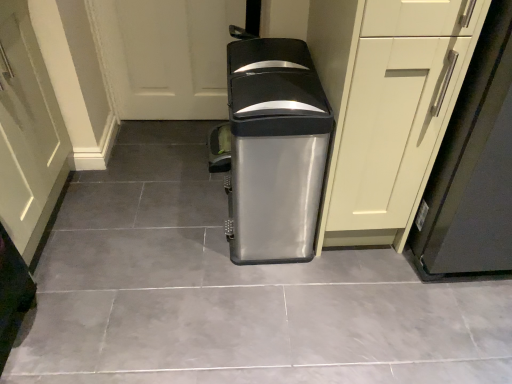
Question: From the image's perspective, is matte white cabinet at center located above matte green door at lower left?

Choices:
 (A) no
 (B) yes

Answer: (B)

Question: Can you confirm if matte white cabinet at center is positioned to the left of matte green door at lower left?

Choices:
 (A) yes
 (B) no

Answer: (B)

Question: Could you tell me if matte white cabinet at center is turned towards matte green door at lower left?

Choices:
 (A) no
 (B) yes

Answer: (A)

Question: Does matte white cabinet at center have a lesser height compared to matte green door at lower left?

Choices:
 (A) yes
 (B) no

Answer: (B)

Question: Is matte green door at lower left surrounded by matte white cabinet at center?

Choices:
 (A) yes
 (B) no

Answer: (B)

Question: In terms of size, does matte green door at lower left appear bigger or smaller than matte white cabinet at right?

Choices:
 (A) small
 (B) big

Answer: (A)

Question: From the image's perspective, is matte green door at lower left located above or below matte white cabinet at right?

Choices:
 (A) above
 (B) below

Answer: (B)

Question: Considering the positions of matte green door at lower left and matte white cabinet at right in the image, is matte green door at lower left taller or shorter than matte white cabinet at right?

Choices:
 (A) tall
 (B) short

Answer: (B)

Question: Which is correct: matte green door at lower left is inside matte white cabinet at right, or outside of it?

Choices:
 (A) outside
 (B) inside

Answer: (A)

Question: Is satin silver trash can at center to the left or to the right of matte white cabinet at right in the image?

Choices:
 (A) left
 (B) right

Answer: (A)

Question: Is satin silver trash can at center inside or outside of matte white cabinet at right?

Choices:
 (A) outside
 (B) inside

Answer: (A)

Question: From the image's perspective, is satin silver trash can at center located above or below matte white cabinet at right?

Choices:
 (A) above
 (B) below

Answer: (B)

Question: Based on their sizes in the image, would you say satin silver trash can at center is bigger or smaller than matte white cabinet at right?

Choices:
 (A) small
 (B) big

Answer: (A)

Question: Is matte white cabinet at center taller or shorter than satin metallic trash can at center?

Choices:
 (A) short
 (B) tall

Answer: (B)

Question: Is point click(x=353, y=152) positioned closer to the camera than point click(x=156, y=203)?

Choices:
 (A) closer
 (B) farther

Answer: (A)